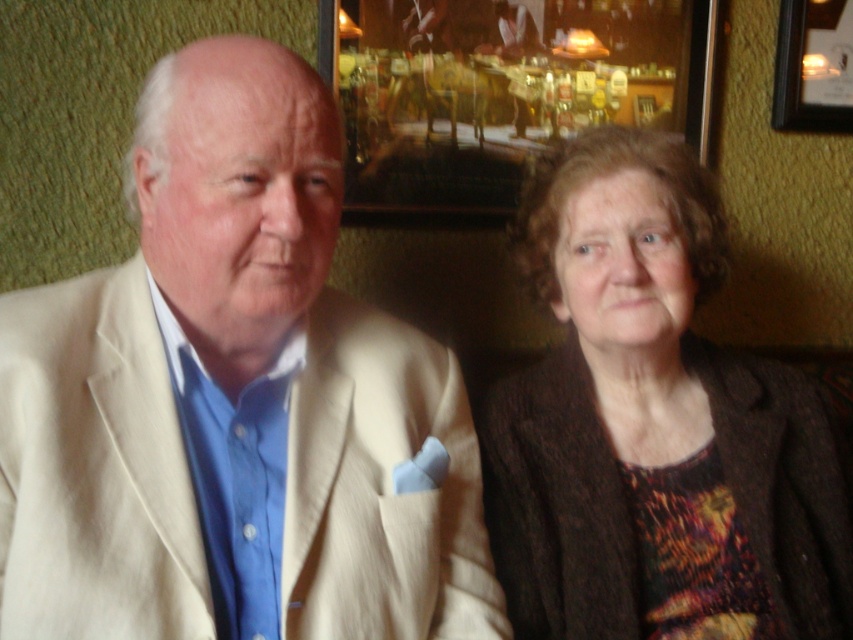
Can you confirm if beige fabric suit at left is bigger than wooden frame at upper center?

Indeed, beige fabric suit at left has a larger size compared to wooden frame at upper center.

Is the position of beige fabric suit at left less distant than that of wooden frame at upper center?

Yes.

Between point (183, 348) and point (503, 168), which one is positioned behind?

Positioned behind is point (503, 168).

What are the coordinates of `beige fabric suit at left` in the screenshot? It's located at (234, 401).

Between brown textured sweater at right and wooden frame at upper center, which one is positioned lower?

brown textured sweater at right is lower down.

This screenshot has width=853, height=640. Identify the location of brown textured sweater at right. (653, 422).

Is point (654, 362) more distant than point (636, 51)?

No, it is in front of (636, 51).

Identify the location of brown textured sweater at right. (653, 422).

Does beige fabric suit at left have a smaller size compared to brown textured sweater at right?

Yes, beige fabric suit at left is smaller than brown textured sweater at right.

Does beige fabric suit at left appear on the left side of brown textured sweater at right?

Correct, you'll find beige fabric suit at left to the left of brown textured sweater at right.

This screenshot has width=853, height=640. What do you see at coordinates (234, 401) in the screenshot?
I see `beige fabric suit at left` at bounding box center [234, 401].

Locate an element on the screen. Image resolution: width=853 pixels, height=640 pixels. beige fabric suit at left is located at coordinates (234, 401).